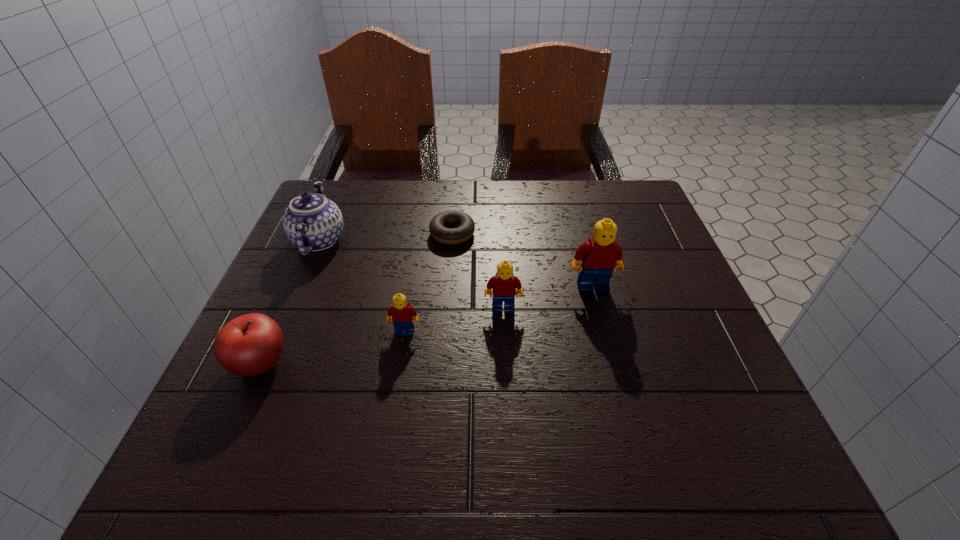
At what (x,y) coordinates should I click in order to perform the action: click on Lego that is the second closest to the nearest object. Please return your answer as a coordinate pair (x, y). The height and width of the screenshot is (540, 960). Looking at the image, I should click on (504, 285).